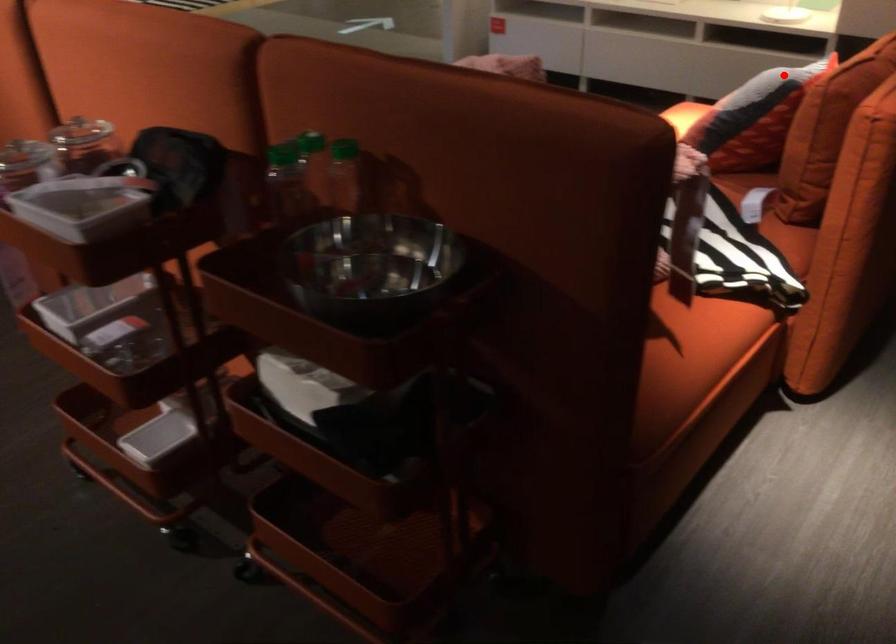
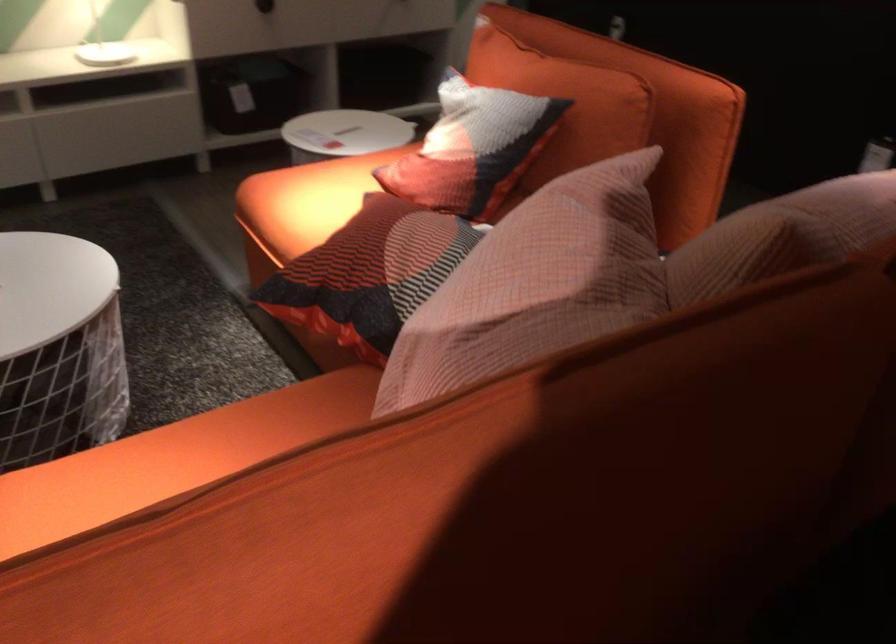
In the second image, find the point that corresponds to the highlighted location in the first image.

(564, 102)